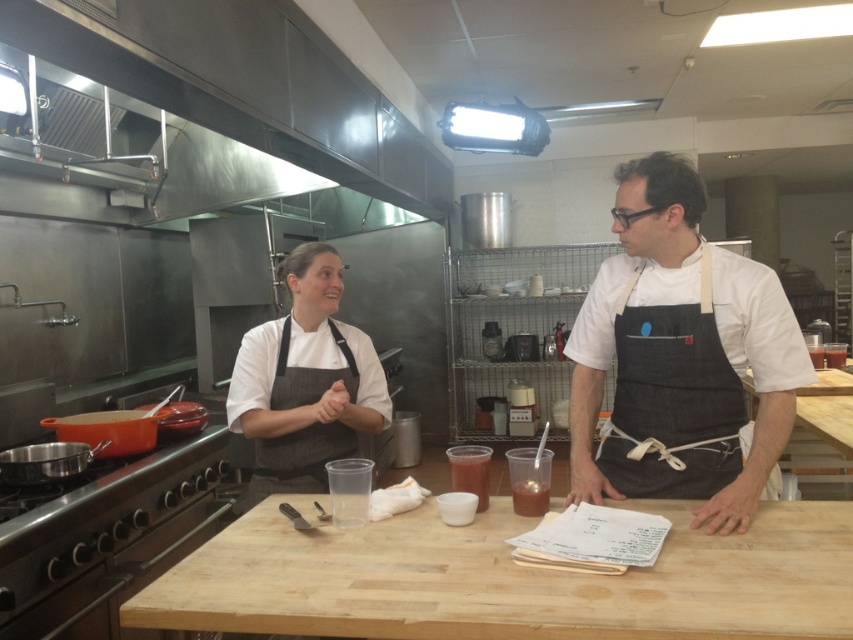
Does point (726, 515) come in front of point (711, 276)?

Yes.

What do you see at coordinates (680, 355) in the screenshot?
I see `dark gray apron at center` at bounding box center [680, 355].

Which is in front, point (677, 364) or point (643, 467)?

Point (677, 364) is more forward.

Find the location of a particular element. This screenshot has height=640, width=853. dark gray apron at center is located at coordinates (680, 355).

Which is above, matte gray apron at center or denim apron at center?

denim apron at center is higher up.

Does matte gray apron at center come behind denim apron at center?

Yes, matte gray apron at center is behind denim apron at center.

Who is more distant from viewer, (x=251, y=435) or (x=665, y=385)?

Point (x=251, y=435)

Where is `matte gray apron at center`? matte gray apron at center is located at coordinates (305, 381).

Between light brown wood at center and matte gray apron at center, which one appears on the right side from the viewer's perspective?

Positioned to the right is light brown wood at center.

Is point (834, 616) positioned after point (349, 404)?

No, (834, 616) is closer to viewer.

Identify the location of light brown wood at center. This screenshot has height=640, width=853. (509, 580).